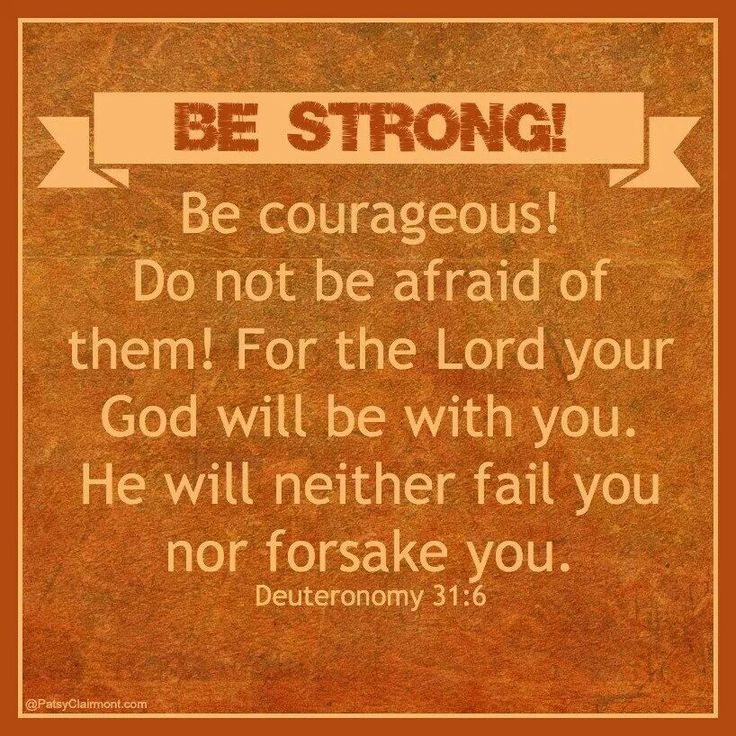
The width and height of the screenshot is (736, 736). I want to click on corners, so click(x=18, y=21), click(x=712, y=17), click(x=715, y=712), click(x=15, y=715).